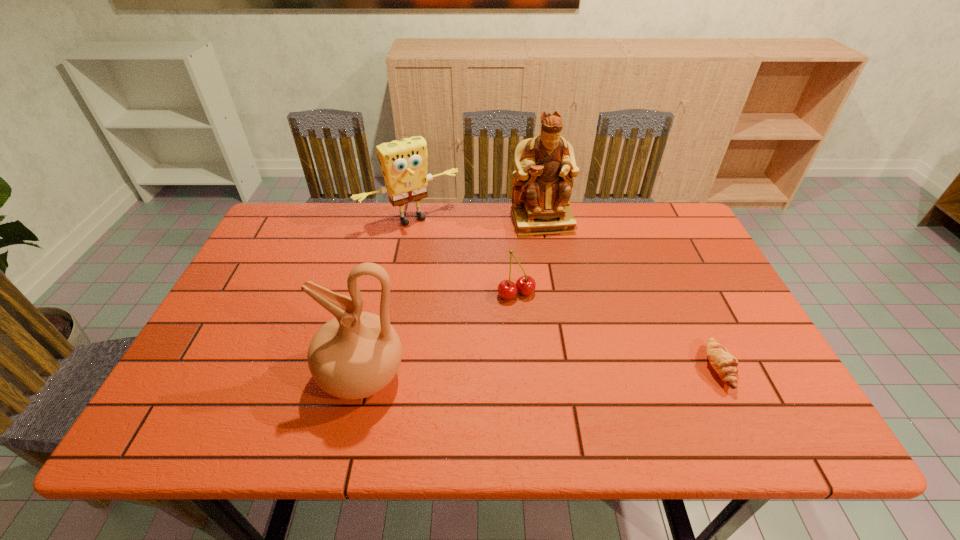
Select which object appears as the third closest to the figurine. Please provide its 2D coordinates. Your answer should be formatted as a tuple, i.e. [(x, y)], where the tuple contains the x and y coordinates of a point satisfying the conditions above.

[(725, 364)]

I want to click on free space that satisfies the following two spatial constraints: 1. on the front side of the third shortest object; 2. on the left side of the cherry, so click(x=396, y=294).